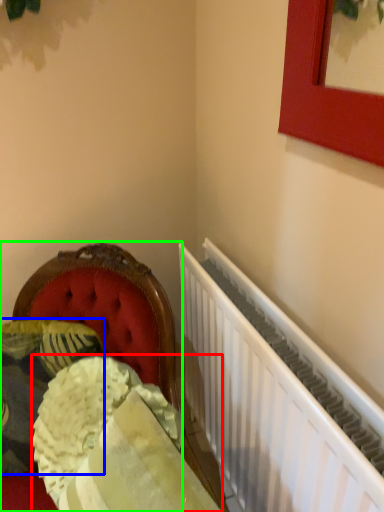
Question: Considering the real-world distances, which object is farthest from material (highlighted by a red box)? pillow (highlighted by a blue box) or furniture (highlighted by a green box)?

Choices:
 (A) pillow
 (B) furniture

Answer: (B)